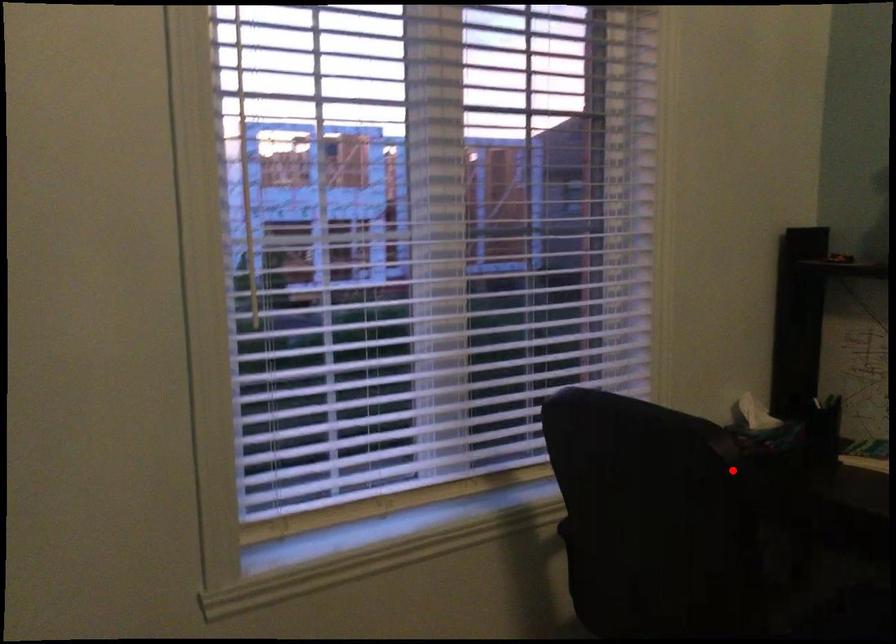
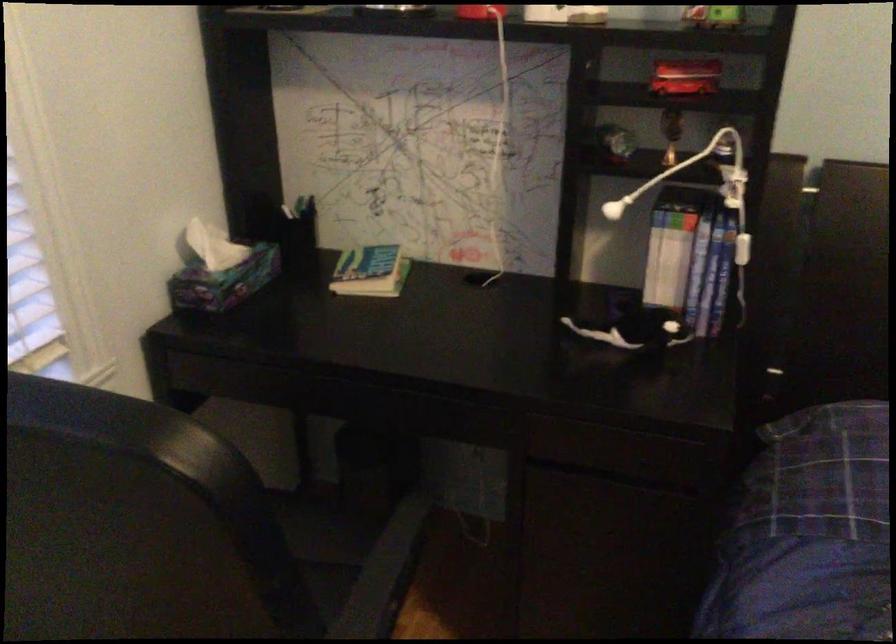
Question: I am providing you with two images of the same scene from different viewpoints. Given a red point in image1, look at the same physical point in image2. Is it:

Choices:
 (A) Closer to the viewpoint
 (B) Farther from the viewpoint

Answer: (A)